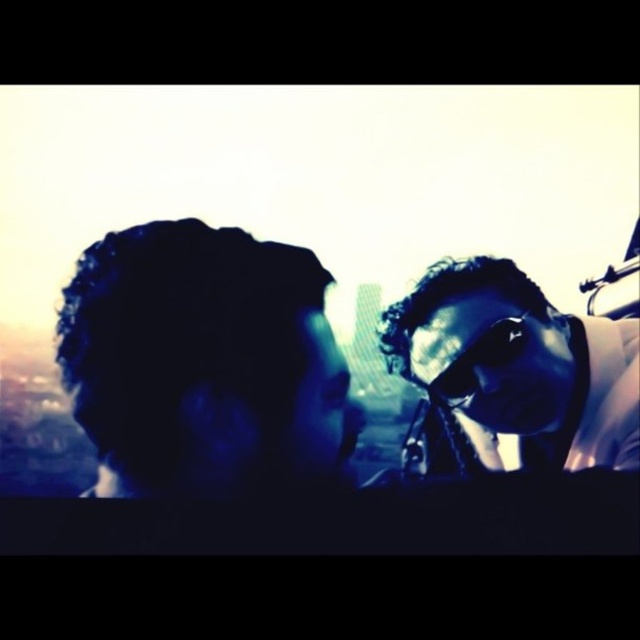
Question: Estimate the real-world distances between objects in this image. Which object is farther from the dark curly hair at left?

Choices:
 (A) sunglasses at center
 (B) shiny black goggles at center

Answer: (A)

Question: Is dark curly hair at left behind shiny black goggles at center?

Choices:
 (A) yes
 (B) no

Answer: (B)

Question: Based on their relative distances, which object is farther from the sunglasses at center?

Choices:
 (A) shiny black goggles at center
 (B) dark curly hair at left

Answer: (B)

Question: Observing the image, what is the correct spatial positioning of sunglasses at center in reference to shiny black goggles at center?

Choices:
 (A) left
 (B) right

Answer: (B)

Question: Is sunglasses at center further to the viewer compared to shiny black goggles at center?

Choices:
 (A) no
 (B) yes

Answer: (A)

Question: Among these points, which one is nearest to the camera?

Choices:
 (A) (83, 292)
 (B) (477, 317)
 (C) (621, 460)

Answer: (A)